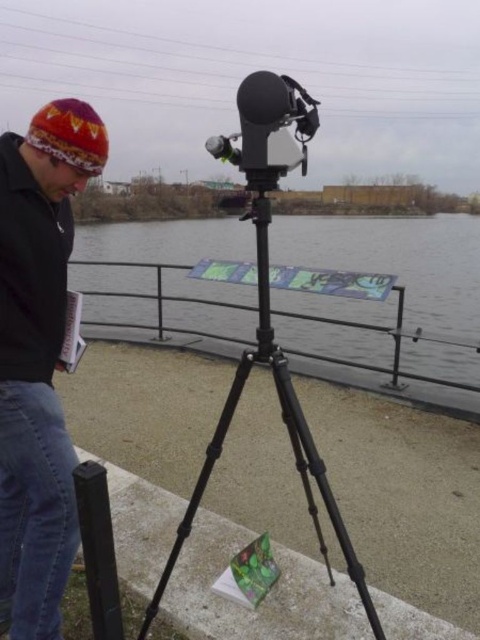
You are a photographer trying to set up a shot. You have a knitted woolen hat at upper left and a black matte tripod at center. Which object is wider?

The knitted woolen hat at upper left is narrower than the black matte tripod at center, so the tripod is wider.

You are a photographer setting up equipment. You have a black matte tripod at center and a matte black video camera at center. Which object is located to the left of the other?

The black matte tripod at center is positioned on the left side of matte black video camera at center.